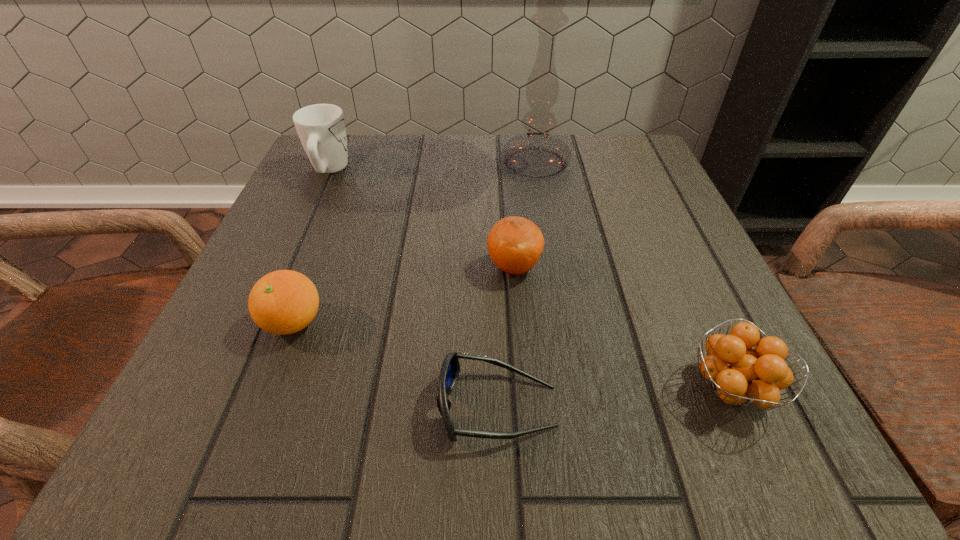
This screenshot has width=960, height=540. In the image, there is a desktop. Identify the location of vacant region at the far edge. (411, 164).

Where is `vacant region at the near edge of the desktop`? Image resolution: width=960 pixels, height=540 pixels. vacant region at the near edge of the desktop is located at coordinates click(x=613, y=416).

Where is `blank space at the left edge of the desktop`? This screenshot has height=540, width=960. blank space at the left edge of the desktop is located at coordinates (213, 339).

Locate an element on the screen. The height and width of the screenshot is (540, 960). vacant space at the right edge of the desktop is located at coordinates (699, 300).

Identify the location of free spot at the near left corner of the desktop. (193, 447).

Locate an element on the screen. This screenshot has height=540, width=960. free space at the far right corner of the desktop is located at coordinates (608, 143).

You are a GUI agent. You are given a task and a screenshot of the screen. Output one action in this format:
    pyautogui.click(x=<x>, y=<y>)
    Task: Click on the vacant region at the near right corner of the desktop
    This screenshot has width=960, height=540.
    Given the screenshot: What is the action you would take?
    pyautogui.click(x=735, y=450)

Where is `free spot between the shortest object and the table lamp`? free spot between the shortest object and the table lamp is located at coordinates (516, 285).

This screenshot has width=960, height=540. I want to click on empty space that is in between the third nearest object and the rightmost orange fruit, so click(512, 355).

Find the location of a particular element. blank region between the fourth farthest object and the fifth shortest object is located at coordinates (311, 246).